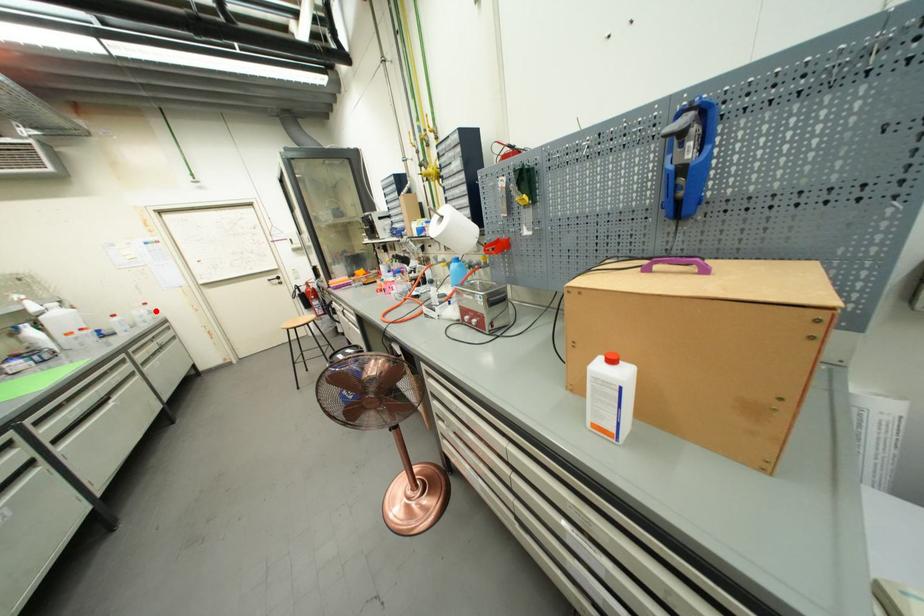
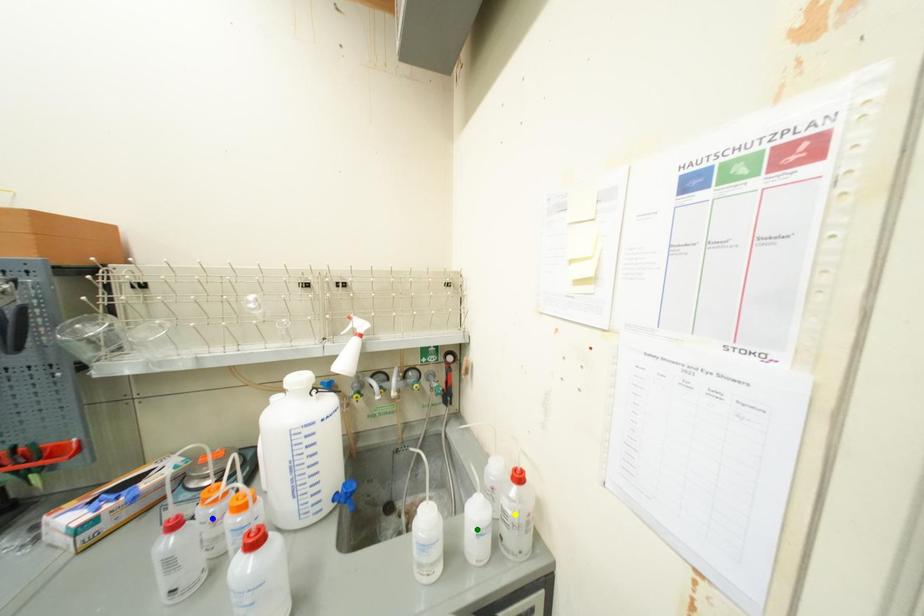
Question: I am providing you with two images of the same scene from different viewpoints. A red point is marked on the first image. You are given multiple points on the second image. Which point in image 2 is actually the same real-world point as the red point in image 1?

Choices:
 (A) blue point
 (B) green point
 (C) yellow point

Answer: (C)